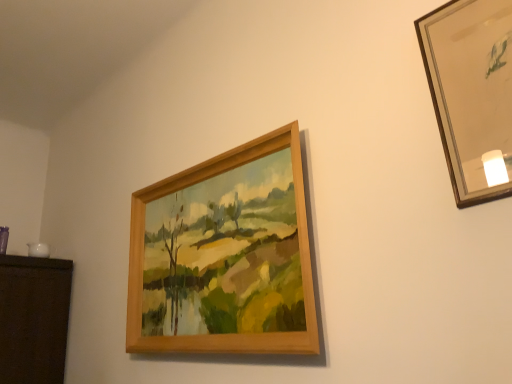
Measure the distance between wooden frame at upper center, which is the first picture frame in back-to-front order, and camera.

A distance of 3.89 feet exists between wooden frame at upper center, which is the first picture frame in back-to-front order, and camera.

The image size is (512, 384). Describe the element at coordinates (224, 256) in the screenshot. I see `wooden frame at upper center, the first picture frame positioned from the left` at that location.

Locate an element on the screen. wooden frame at upper center, the first picture frame positioned from the left is located at coordinates (224, 256).

What do you see at coordinates (472, 93) in the screenshot?
I see `wooden picture frame at upper right, which ranks as the 2th picture frame in left-to-right order` at bounding box center [472, 93].

You are a GUI agent. You are given a task and a screenshot of the screen. Output one action in this format:
    pyautogui.click(x=<x>, y=<y>)
    Task: Click on the wooden picture frame at upper right, positioned as the 1th picture frame in front-to-back order
    The image size is (512, 384).
    Given the screenshot: What is the action you would take?
    pyautogui.click(x=472, y=93)

What is the approximate width of wooden picture frame at upper right, which ranks as the 2th picture frame in left-to-right order?

wooden picture frame at upper right, which ranks as the 2th picture frame in left-to-right order, is 1.95 inches in width.

At what (x,y) coordinates should I click in order to perform the action: click on wooden frame at upper center, which is the first picture frame in back-to-front order. Please return your answer as a coordinate pair (x, y). Looking at the image, I should click on (224, 256).

Considering the positions of objects wooden frame at upper center, the first picture frame positioned from the left, and wooden picture frame at upper right, positioned as the 1th picture frame in front-to-back order, in the image provided, who is more to the right, wooden frame at upper center, the first picture frame positioned from the left, or wooden picture frame at upper right, positioned as the 1th picture frame in front-to-back order,?

From the viewer's perspective, wooden picture frame at upper right, positioned as the 1th picture frame in front-to-back order, appears more on the right side.

In the image, is wooden frame at upper center, which is counted as the second picture frame, starting from the front, positioned in front of or behind wooden picture frame at upper right, marked as the 2th picture frame in a back-to-front arrangement?

wooden frame at upper center, which is counted as the second picture frame, starting from the front, is positioned farther from the viewer than wooden picture frame at upper right, marked as the 2th picture frame in a back-to-front arrangement.

Does point (208, 196) come closer to viewer compared to point (467, 8)?

No.

From the image's perspective, between wooden frame at upper center, which is counted as the second picture frame, starting from the front, and wooden picture frame at upper right, which ranks as the 2th picture frame in left-to-right order, which one is located above?

→ wooden picture frame at upper right, which ranks as the 2th picture frame in left-to-right order, is shown above in the image.

From a real-world perspective, is wooden frame at upper center, the first picture frame positioned from the left, positioned above or below wooden picture frame at upper right, which appears as the first picture frame when viewed from the right?

wooden frame at upper center, the first picture frame positioned from the left, is below wooden picture frame at upper right, which appears as the first picture frame when viewed from the right.

Considering the sizes of objects wooden frame at upper center, which is the first picture frame in back-to-front order, and wooden picture frame at upper right, marked as the 2th picture frame in a back-to-front arrangement, in the image provided, who is thinner, wooden frame at upper center, which is the first picture frame in back-to-front order, or wooden picture frame at upper right, marked as the 2th picture frame in a back-to-front arrangement,?

wooden picture frame at upper right, marked as the 2th picture frame in a back-to-front arrangement, is thinner.

Which of these two, wooden frame at upper center, which is counted as the second picture frame, starting from the front, or wooden picture frame at upper right, positioned as the 1th picture frame in front-to-back order, stands taller?

With more height is wooden frame at upper center, which is counted as the second picture frame, starting from the front.

Looking at the image, does wooden frame at upper center, which is counted as the second picture frame, starting from the front, seem bigger or smaller compared to wooden picture frame at upper right, positioned as the 1th picture frame in front-to-back order?

wooden frame at upper center, which is counted as the second picture frame, starting from the front, is bigger than wooden picture frame at upper right, positioned as the 1th picture frame in front-to-back order.

Is wooden frame at upper center, which is counted as the second picture frame, starting from the front, situated inside wooden picture frame at upper right, which ranks as the 2th picture frame in left-to-right order, or outside?

wooden frame at upper center, which is counted as the second picture frame, starting from the front, lies outside wooden picture frame at upper right, which ranks as the 2th picture frame in left-to-right order.

Is wooden frame at upper center, the second picture frame from the right, in contact with wooden picture frame at upper right, marked as the 2th picture frame in a back-to-front arrangement?

No, wooden frame at upper center, the second picture frame from the right, is not with wooden picture frame at upper right, marked as the 2th picture frame in a back-to-front arrangement.

Is wooden frame at upper center, the first picture frame positioned from the left, facing towards wooden picture frame at upper right, marked as the 2th picture frame in a back-to-front arrangement?

No, wooden frame at upper center, the first picture frame positioned from the left, is not facing towards wooden picture frame at upper right, marked as the 2th picture frame in a back-to-front arrangement.

Find the location of `picture frame behind the wooden picture frame at upper right, positioned as the 1th picture frame in front-to-back order`. picture frame behind the wooden picture frame at upper right, positioned as the 1th picture frame in front-to-back order is located at coordinates (224, 256).

Which object is positioned more to the right, wooden picture frame at upper right, positioned as the 1th picture frame in front-to-back order, or wooden frame at upper center, the first picture frame positioned from the left?

From the viewer's perspective, wooden picture frame at upper right, positioned as the 1th picture frame in front-to-back order, appears more on the right side.

Is wooden picture frame at upper right, which ranks as the 2th picture frame in left-to-right order, further to camera compared to wooden frame at upper center, which is counted as the second picture frame, starting from the front?

No, the depth of wooden picture frame at upper right, which ranks as the 2th picture frame in left-to-right order, is less than that of wooden frame at upper center, which is counted as the second picture frame, starting from the front.

Does point (433, 84) lie in front of point (155, 195)?

Yes, it is in front of point (155, 195).

From the image's perspective, would you say wooden picture frame at upper right, which ranks as the 2th picture frame in left-to-right order, is shown under wooden frame at upper center, the second picture frame from the right?

Incorrect, from the image's perspective, wooden picture frame at upper right, which ranks as the 2th picture frame in left-to-right order, is higher than wooden frame at upper center, the second picture frame from the right.

From a real-world perspective, is wooden picture frame at upper right, which ranks as the 2th picture frame in left-to-right order, on wooden frame at upper center, which is the first picture frame in back-to-front order?

Yes, from a real-world perspective, wooden picture frame at upper right, which ranks as the 2th picture frame in left-to-right order, is above wooden frame at upper center, which is the first picture frame in back-to-front order.

Between wooden picture frame at upper right, which ranks as the 2th picture frame in left-to-right order, and wooden frame at upper center, the first picture frame positioned from the left, which one has larger width?

wooden frame at upper center, the first picture frame positioned from the left, is wider.

Is wooden picture frame at upper right, marked as the 2th picture frame in a back-to-front arrangement, shorter than wooden frame at upper center, which is the first picture frame in back-to-front order?

Yes, wooden picture frame at upper right, marked as the 2th picture frame in a back-to-front arrangement, is shorter than wooden frame at upper center, which is the first picture frame in back-to-front order.

Between wooden picture frame at upper right, which ranks as the 2th picture frame in left-to-right order, and wooden frame at upper center, the second picture frame from the right, which one has smaller size?

wooden picture frame at upper right, which ranks as the 2th picture frame in left-to-right order.

Would you say wooden picture frame at upper right, which appears as the first picture frame when viewed from the right, contains wooden frame at upper center, which is counted as the second picture frame, starting from the front?

That's incorrect, wooden frame at upper center, which is counted as the second picture frame, starting from the front, is not inside wooden picture frame at upper right, which appears as the first picture frame when viewed from the right.

Is wooden picture frame at upper right, marked as the 2th picture frame in a back-to-front arrangement, directly adjacent to wooden frame at upper center, which is counted as the second picture frame, starting from the front?

They are not placed beside each other.

Looking at this image, is wooden picture frame at upper right, positioned as the 1th picture frame in front-to-back order, oriented away from wooden frame at upper center, which is the first picture frame in back-to-front order?

No, wooden frame at upper center, which is the first picture frame in back-to-front order, is not at the back of wooden picture frame at upper right, positioned as the 1th picture frame in front-to-back order.

Could you measure the distance between wooden picture frame at upper right, which ranks as the 2th picture frame in left-to-right order, and wooden frame at upper center, the second picture frame from the right?

wooden picture frame at upper right, which ranks as the 2th picture frame in left-to-right order, and wooden frame at upper center, the second picture frame from the right, are 73.74 centimeters apart.

This screenshot has width=512, height=384. Find the location of `picture frame on the right of wooden frame at upper center, which is counted as the second picture frame, starting from the front`. picture frame on the right of wooden frame at upper center, which is counted as the second picture frame, starting from the front is located at coordinates click(472, 93).

Identify the location of picture frame located on the left of wooden picture frame at upper right, marked as the 2th picture frame in a back-to-front arrangement. The image size is (512, 384). 224,256.

In order to click on picture frame in front of the wooden frame at upper center, which is counted as the second picture frame, starting from the front in this screenshot , I will do `click(472, 93)`.